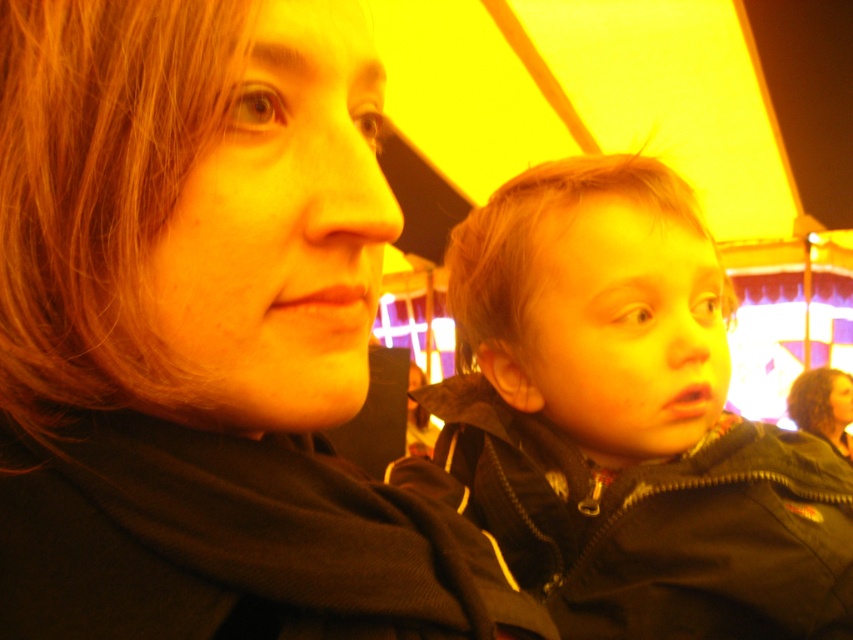
Which of these two, matte black jacket at upper left or matte black jacket at right, stands taller?

matte black jacket at right

Who is higher up, matte black jacket at upper left or matte black jacket at right?

Positioned higher is matte black jacket at right.

Identify the location of matte black jacket at upper left. (204, 336).

Where is `matte black jacket at upper left`? The width and height of the screenshot is (853, 640). matte black jacket at upper left is located at coordinates (204, 336).